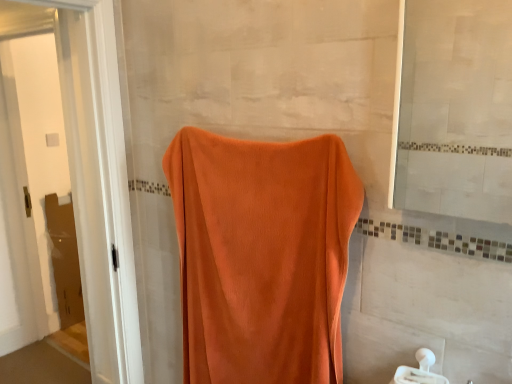
Question: Can you confirm if orange towel at left is smaller than orange velvety towel at center?

Choices:
 (A) yes
 (B) no

Answer: (B)

Question: Is orange towel at left taller than orange velvety towel at center?

Choices:
 (A) yes
 (B) no

Answer: (A)

Question: Is orange towel at left facing towards orange velvety towel at center?

Choices:
 (A) yes
 (B) no

Answer: (A)

Question: Is orange towel at left located outside orange velvety towel at center?

Choices:
 (A) yes
 (B) no

Answer: (A)

Question: From a real-world perspective, is orange towel at left located higher than orange velvety towel at center?

Choices:
 (A) yes
 (B) no

Answer: (A)

Question: From a real-world perspective, is orange towel at left below orange velvety towel at center?

Choices:
 (A) no
 (B) yes

Answer: (A)

Question: Is orange towel at left placed right next to matte glass mirror at upper right?

Choices:
 (A) yes
 (B) no

Answer: (B)

Question: Can you confirm if orange towel at left is shorter than matte glass mirror at upper right?

Choices:
 (A) yes
 (B) no

Answer: (B)

Question: Does orange towel at left have a greater height compared to matte glass mirror at upper right?

Choices:
 (A) yes
 (B) no

Answer: (A)

Question: Does orange towel at left contain matte glass mirror at upper right?

Choices:
 (A) yes
 (B) no

Answer: (B)

Question: Is orange towel at left oriented away from matte glass mirror at upper right?

Choices:
 (A) yes
 (B) no

Answer: (B)

Question: Does orange towel at left turn towards matte glass mirror at upper right?

Choices:
 (A) yes
 (B) no

Answer: (A)

Question: Considering the relative sizes of white plastic towel bar at lower right and orange towel at left in the image provided, is white plastic towel bar at lower right smaller than orange towel at left?

Choices:
 (A) yes
 (B) no

Answer: (A)